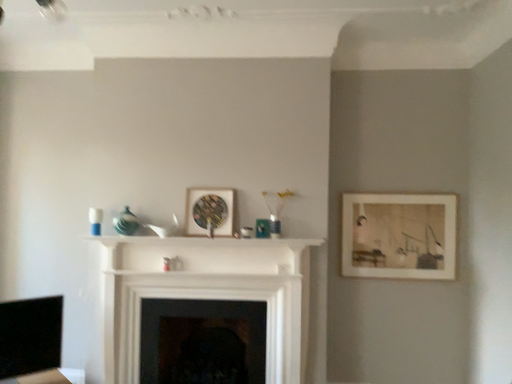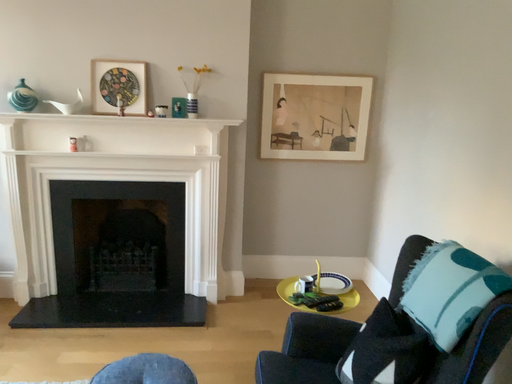
Question: Which way did the camera rotate in the video?

Choices:
 (A) rotated downward
 (B) rotated upward

Answer: (A)